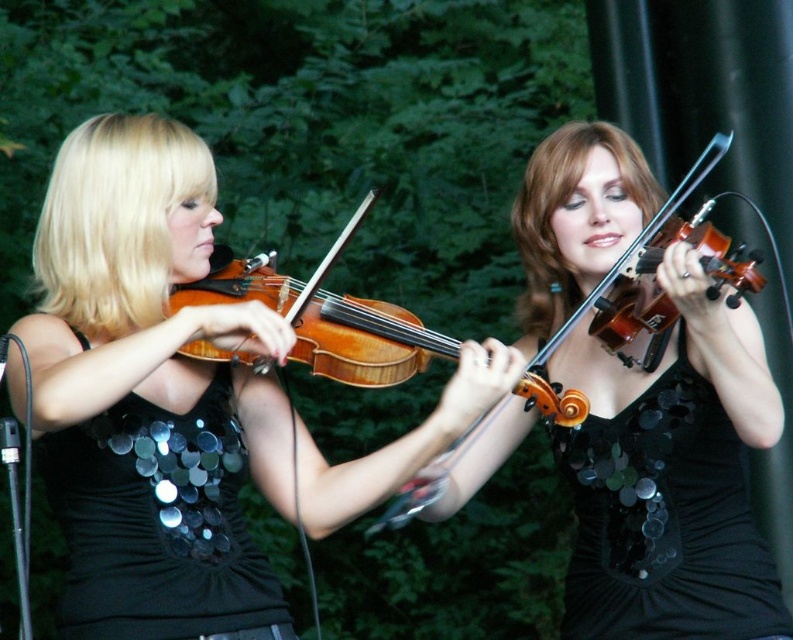
You are a photographer setting up for a live performance. You need to adjust the camera height to ensure both the shiny sequined top at center and the black sequined dress at center are fully visible in the frame. Based on their heights, which one requires you to set the camera higher?

The shiny sequined top at center is much taller than the black sequined dress at center, so you should set the camera height to accommodate the taller shiny sequined top at center to ensure both are fully visible.

You are a photographer setting up for a live performance. You need to capture a close shot of both the shiny sequined top at center and the black sequined dress at center. Given that your camera has a maximum focus range of 15 inches, will you be able to focus on both subjects simultaneously?

The shiny sequined top at center is 15.69 inches from the black sequined dress at center. Since the distance between them exceeds the camera maximum focus range of 15 inches, you cannot focus on both subjects simultaneously.